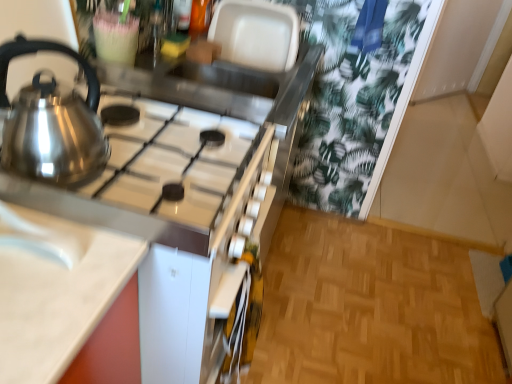
Based on the photo, measure the distance between point (46, 166) and camera.

The distance of point (46, 166) from camera is 29.96 inches.

Find the location of a particular element. satin silver gas stove at upper left is located at coordinates (169, 160).

From a real-world perspective, between white glossy sink at lower left and satin metallic kettle at left, who is vertically higher?

satin metallic kettle at left.

Considering their positions, is white glossy sink at lower left located in front of or behind satin metallic kettle at left?

white glossy sink at lower left is in front of satin metallic kettle at left.

Between white glossy sink at lower left and satin metallic kettle at left, which one has more height?

Standing taller between the two is satin metallic kettle at left.

Would you say satin silver gas stove at upper left is a long distance from satin metallic kettle at left?

They are positioned close to each other.

Is satin silver gas stove at upper left further to the viewer compared to satin metallic kettle at left?

Yes.

From a real-world perspective, is satin silver gas stove at upper left positioned under satin metallic kettle at left based on gravity?

Indeed, from a real-world perspective, satin silver gas stove at upper left is positioned beneath satin metallic kettle at left.

From the image's perspective, which is above, satin silver gas stove at upper left or satin metallic kettle at left?

satin metallic kettle at left is shown above in the image.

In the image, is satin silver gas stove at upper left on the left side or the right side of white glossy sink at lower left?

Based on their positions, satin silver gas stove at upper left is located to the right of white glossy sink at lower left.

Is satin silver gas stove at upper left further to the viewer compared to white glossy sink at lower left?

Yes, the depth of satin silver gas stove at upper left is greater than that of white glossy sink at lower left.

Who is bigger, satin silver gas stove at upper left or white glossy sink at lower left?

Bigger between the two is satin silver gas stove at upper left.

Is satin silver gas stove at upper left shorter than white glossy sink at lower left?

In fact, satin silver gas stove at upper left may be taller than white glossy sink at lower left.

Which of these two, white glossy sink at lower left or satin silver gas stove at upper left, is thinner?

white glossy sink at lower left is thinner.

From the image's perspective, is white glossy sink at lower left located above satin silver gas stove at upper left?

Incorrect, from the image's perspective, white glossy sink at lower left is lower than satin silver gas stove at upper left.

Could you tell me if white glossy sink at lower left is facing satin silver gas stove at upper left?

No, white glossy sink at lower left is not oriented towards satin silver gas stove at upper left.

Considering the sizes of objects white glossy sink at lower left and satin silver gas stove at upper left in the image provided, who is shorter, white glossy sink at lower left or satin silver gas stove at upper left?

white glossy sink at lower left.

In the scene shown: Is satin metallic kettle at left further to the viewer compared to white glossy sink at lower left?

Yes, satin metallic kettle at left is further from the camera.

Considering the points (55, 84) and (65, 248), which point is in front, point (55, 84) or point (65, 248)?

The point (65, 248) is more forward.

Does satin metallic kettle at left have a greater height compared to white glossy sink at lower left?

Yes, satin metallic kettle at left is taller than white glossy sink at lower left.

How many degrees apart are the facing directions of satin metallic kettle at left and white glossy sink at lower left?

satin metallic kettle at left and white glossy sink at lower left are facing 8.58e-05 degrees away from each other.

Between point (65, 111) and point (156, 122), which one is positioned behind?

The point (156, 122) is farther from the camera.

Who is smaller, satin metallic kettle at left or satin silver gas stove at upper left?

satin metallic kettle at left.

From the image's perspective, who appears lower, satin metallic kettle at left or satin silver gas stove at upper left?

From the image's view, satin silver gas stove at upper left is below.

Which is more to the left, satin metallic kettle at left or satin silver gas stove at upper left?

Positioned to the left is satin metallic kettle at left.

What are the coordinates of `sink located in front of the satin metallic kettle at left` in the screenshot? It's located at (42, 235).

Where is `kettle lying on the left of satin silver gas stove at upper left`? kettle lying on the left of satin silver gas stove at upper left is located at coordinates (52, 123).

When comparing their distances from white glossy sink at lower left, does satin silver gas stove at upper left or satin metallic kettle at left seem further?

Based on the image, satin silver gas stove at upper left appears to be further to white glossy sink at lower left.

Looking at the image, which one is located closer to white glossy sink at lower left, satin metallic kettle at left or satin silver gas stove at upper left?

Based on the image, satin metallic kettle at left appears to be nearer to white glossy sink at lower left.

Looking at the image, which one is located further to satin silver gas stove at upper left, satin metallic kettle at left or white glossy sink at lower left?

Based on the image, white glossy sink at lower left appears to be further to satin silver gas stove at upper left.

Based on their spatial positions, is satin silver gas stove at upper left or white glossy sink at lower left further from satin metallic kettle at left?

white glossy sink at lower left is positioned further to the anchor satin metallic kettle at left.

Considering their positions, is white glossy sink at lower left positioned further to satin metallic kettle at left than satin silver gas stove at upper left?

white glossy sink at lower left lies further to satin metallic kettle at left than the other object.

Considering their positions, is white glossy sink at lower left positioned further to satin silver gas stove at upper left than satin metallic kettle at left?

Based on the image, white glossy sink at lower left appears to be further to satin silver gas stove at upper left.

At what (x,y) coordinates should I click in order to perform the action: click on gas stove that lies between satin metallic kettle at left and white glossy sink at lower left from top to bottom. Please return your answer as a coordinate pair (x, y). Looking at the image, I should click on (169, 160).